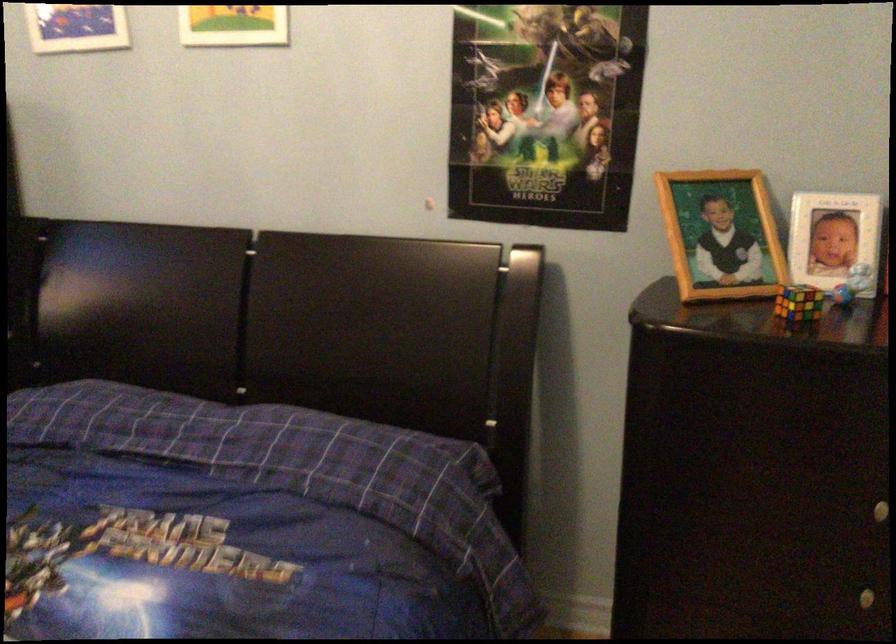
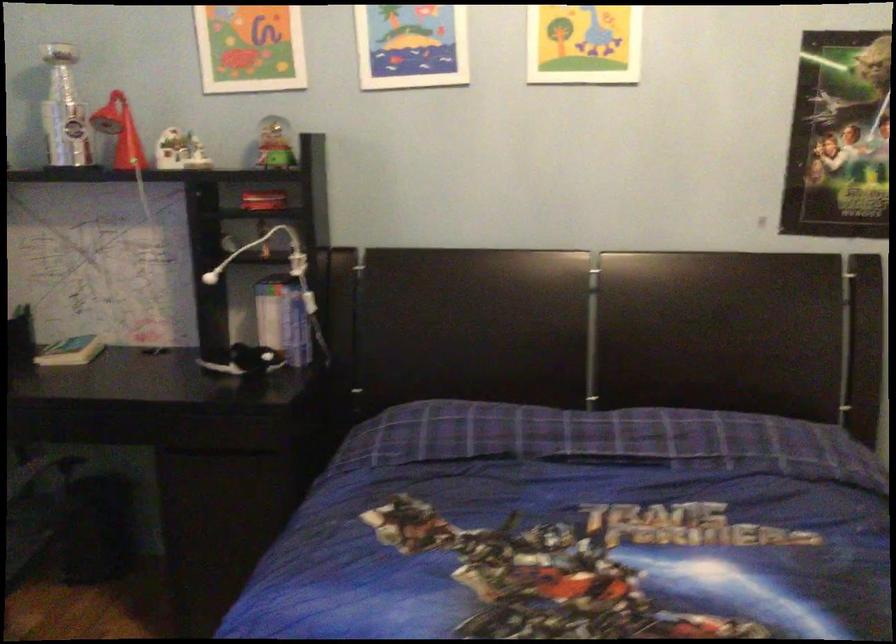
Question: What movement of the cameraman would produce the second image?

Choices:
 (A) Left
 (B) Right
 (C) Forward
 (D) Backward

Answer: (A)